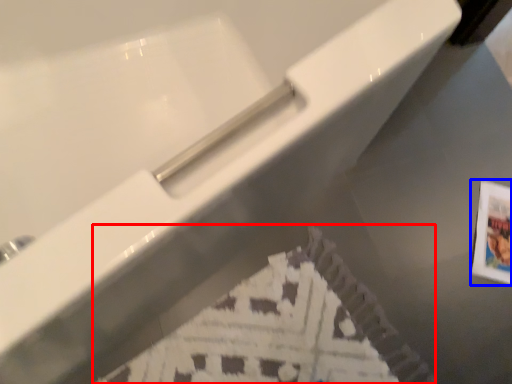
Question: Among these objects, which one is nearest to the camera, flyer (highlighted by a red box) or postcard (highlighted by a blue box)?

Choices:
 (A) flyer
 (B) postcard

Answer: (A)